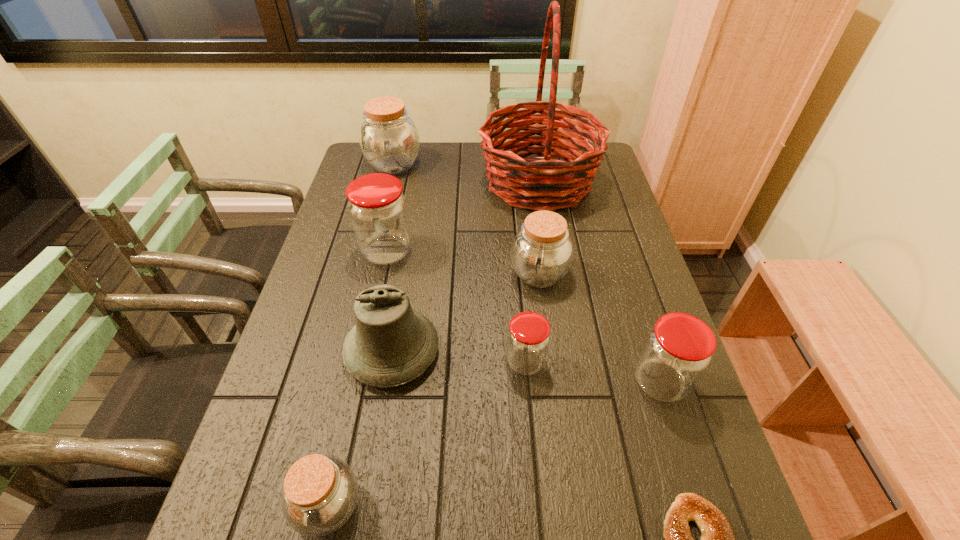
Identify the location of the tallest object. (523, 183).

Where is `the farthest jar`? the farthest jar is located at coordinates (389, 139).

The width and height of the screenshot is (960, 540). I want to click on the farthest brown jar, so 389,139.

I want to click on the farthest red jar, so pos(377,207).

Identify the location of the leftmost red jar. (377, 207).

Identify the location of bell. The height and width of the screenshot is (540, 960). (391, 344).

This screenshot has height=540, width=960. Identify the location of the second farthest brown jar. (542, 252).

Identify the location of the second smallest brown jar. This screenshot has width=960, height=540. (542, 252).

Where is `the rightmost red jar`? This screenshot has height=540, width=960. the rightmost red jar is located at coordinates (677, 351).

Where is `the second biggest red jar`? Image resolution: width=960 pixels, height=540 pixels. the second biggest red jar is located at coordinates (677, 351).